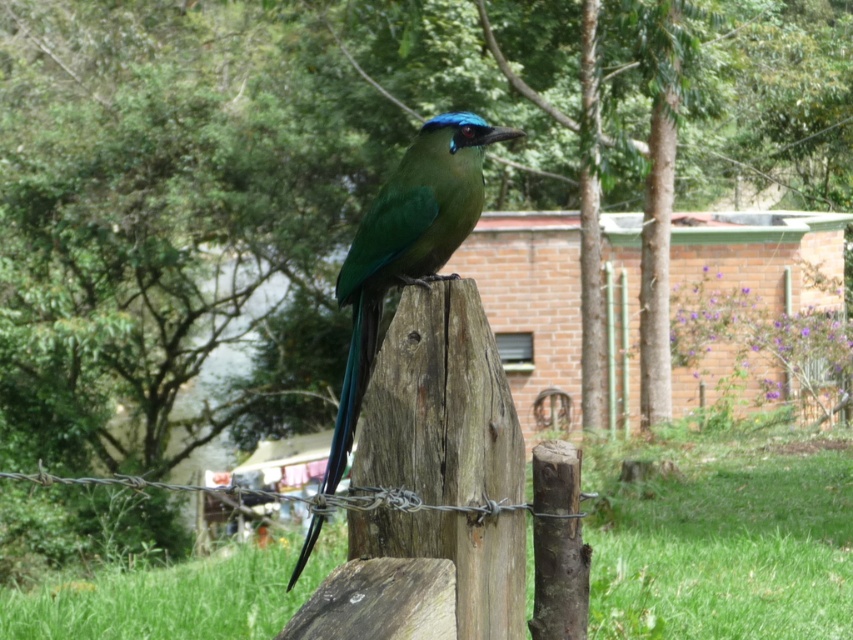
Does weathered wood post at center appear over green glossy bird at center?

Indeed, weathered wood post at center is positioned over green glossy bird at center.

Between point (519, 472) and point (386, 260), which one is positioned in front?

Positioned in front is point (519, 472).

In order to click on weathered wood post at center in this screenshot , I will do click(x=440, y=404).

Which is more to the right, green glossy bird at center or barbed wire at center?

green glossy bird at center is more to the right.

Can you confirm if green glossy bird at center is shorter than barbed wire at center?

Yes.

Is point (444, 276) positioned after point (352, 502)?

Yes, point (444, 276) is farther from viewer.

The width and height of the screenshot is (853, 640). Identify the location of green glossy bird at center. (405, 246).

Based on the photo, is weathered wood post at center to the right of barbed wire at center from the viewer's perspective?

Indeed, weathered wood post at center is positioned on the right side of barbed wire at center.

Can you confirm if weathered wood post at center is thinner than barbed wire at center?

Correct, weathered wood post at center's width is less than barbed wire at center's.

The image size is (853, 640). I want to click on weathered wood post at center, so click(x=440, y=404).